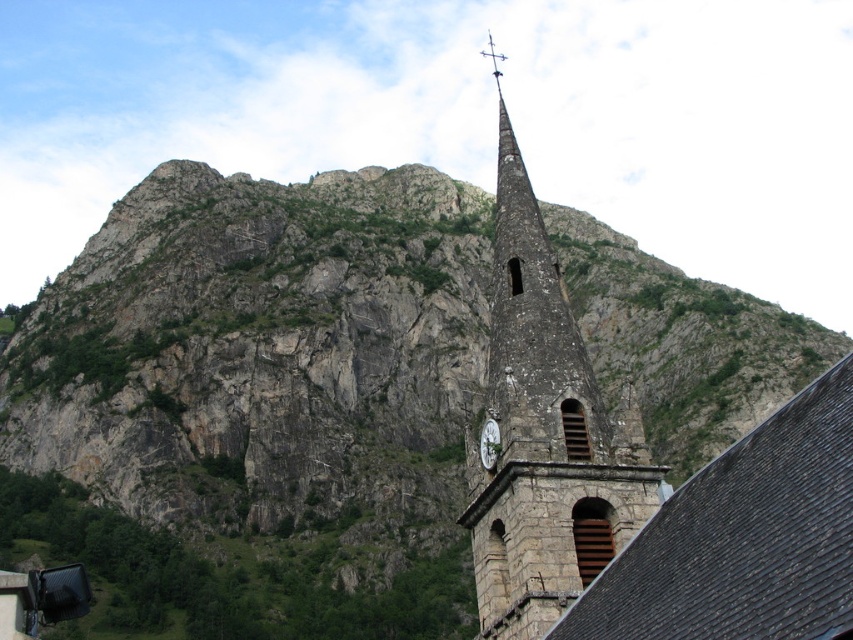
You are standing in front of a historic site and want to take a photo of both the stone clock tower at center and the white stone clock at center. Which object should you focus on first to ensure both are in the frame?

You should focus on the stone clock tower at center first because it is closer to you than the white stone clock at center, ensuring both are in the frame by adjusting the camera angle accordingly.

You are standing at the base of the mountain and looking towards the historic stone church tower. There is a specific point marked at coordinates point (544, 433). Can you tell me which object this point is located on?

The point (544, 433) is located on the stone clock tower at center.

You are a maintenance worker needing to reach the white stone clock at center from the stone clock tower at center. Can you safely climb the structure if the ladder you have is 12 meters long?

The distance between the stone clock tower at center and the white stone clock at center is 13.46 meters. Since your ladder is only 12 meters long, it is not long enough to safely reach the white stone clock at center from the stone clock tower at center.